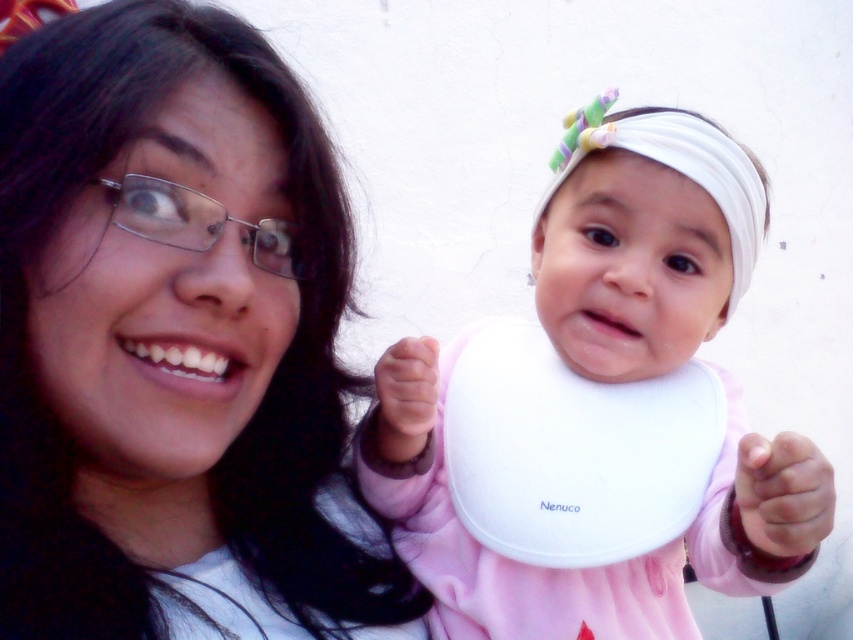
Who is taller, white fabric bib at center or white fabric headscarf at upper right?

white fabric bib at center is taller.

How distant is white fabric bib at center from white fabric headscarf at upper right?

A distance of 3.94 inches exists between white fabric bib at center and white fabric headscarf at upper right.

Is point (726, 449) behind point (595, 118)?

Yes, it is.

Find the location of a particular element. This screenshot has width=853, height=640. white fabric bib at center is located at coordinates (643, 243).

Is matte white shirt at upper left closer to the viewer compared to white fabric bib at center?

Yes, matte white shirt at upper left is closer to the viewer.

Looking at this image, which is more to the left, matte white shirt at upper left or white fabric bib at center?

Positioned to the left is matte white shirt at upper left.

Describe the element at coordinates (175, 342) in the screenshot. This screenshot has width=853, height=640. I see `matte white shirt at upper left` at that location.

Find the location of a particular element. matte white shirt at upper left is located at coordinates coord(175,342).

Can you confirm if matte white shirt at upper left is positioned to the right of white fabric headscarf at upper right?

No, matte white shirt at upper left is not to the right of white fabric headscarf at upper right.

This screenshot has width=853, height=640. What do you see at coordinates (175, 342) in the screenshot?
I see `matte white shirt at upper left` at bounding box center [175, 342].

Identify the location of matte white shirt at upper left. (175, 342).